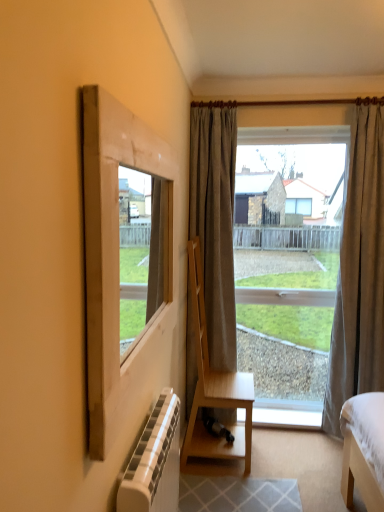
Where is `white painted wood at lower center`? white painted wood at lower center is located at coordinates (287, 414).

Locate an element on the screen. natural wood frame at left is located at coordinates (119, 265).

Locate an element on the screen. clear glass window at center is located at coordinates (344, 217).

This screenshot has width=384, height=512. In order to click on matte gray curtain at right, positioned as the 2th curtain in left-to-right order in this screenshot , I will do `click(359, 272)`.

Find the location of `white textured radiator at lower left`. white textured radiator at lower left is located at coordinates (154, 462).

Where is `white painted wood at lower center`? This screenshot has width=384, height=512. white painted wood at lower center is located at coordinates (287, 414).

Visually, is white painted wood at lower center positioned to the left or to the right of gray fabric curtain at center, the 1th curtain positioned from the left?

From the image, it's evident that white painted wood at lower center is to the right of gray fabric curtain at center, the 1th curtain positioned from the left.

Identify the location of the 1st curtain in front of the white painted wood at lower center. The height and width of the screenshot is (512, 384). (215, 224).

Is white painted wood at lower center facing towards gray fabric curtain at center, marked as the 2th curtain in a right-to-left arrangement?

No.

From the picture: Considering the relative sizes of white painted wood at lower center and gray fabric curtain at center, the 1th curtain positioned from the left, in the image provided, is white painted wood at lower center wider than gray fabric curtain at center, the 1th curtain positioned from the left,?

Yes.

Is matte gray curtain at right, the first curtain positioned from the right, not near light brown wooden chair at center?

No.

Does matte gray curtain at right, positioned as the 2th curtain in left-to-right order, lie behind light brown wooden chair at center?

Yes, matte gray curtain at right, positioned as the 2th curtain in left-to-right order, is behind light brown wooden chair at center.

Is matte gray curtain at right, positioned as the 2th curtain in left-to-right order, taller than light brown wooden chair at center?

Yes.

Considering the relative positions of matte gray curtain at right, the first curtain positioned from the right, and light brown wooden chair at center in the image provided, is matte gray curtain at right, the first curtain positioned from the right, to the left or to the right of light brown wooden chair at center?

matte gray curtain at right, the first curtain positioned from the right, is to the right of light brown wooden chair at center.

Can you confirm if white painted wood at lower center is bigger than natural wood frame at left?

Incorrect, white painted wood at lower center is not larger than natural wood frame at left.

Is white painted wood at lower center located outside natural wood frame at left?

Yes, white painted wood at lower center is outside of natural wood frame at left.

Is white painted wood at lower center closer to the viewer compared to natural wood frame at left?

No.

Considering their positions, is gray fabric curtain at center, the 1th curtain positioned from the left, located in front of or behind white textured radiator at lower left?

gray fabric curtain at center, the 1th curtain positioned from the left, is positioned farther from the viewer than white textured radiator at lower left.

Is gray fabric curtain at center, the 1th curtain positioned from the left, positioned far away from white textured radiator at lower left?

Yes, gray fabric curtain at center, the 1th curtain positioned from the left, is far from white textured radiator at lower left.

Locate an element on the screen. This screenshot has width=384, height=512. radiator in front of the gray fabric curtain at center, marked as the 2th curtain in a right-to-left arrangement is located at coordinates (154, 462).

Is white textured radiator at lower left oriented away from matte gray curtain at right, the first curtain positioned from the right?

No, matte gray curtain at right, the first curtain positioned from the right, is not at the back of white textured radiator at lower left.

Does white textured radiator at lower left have a greater width compared to matte gray curtain at right, the first curtain positioned from the right?

Incorrect, the width of white textured radiator at lower left does not surpass that of matte gray curtain at right, the first curtain positioned from the right.

Is white textured radiator at lower left not inside matte gray curtain at right, the first curtain positioned from the right?

Yes, white textured radiator at lower left is outside of matte gray curtain at right, the first curtain positioned from the right.

Based on the photo, is gray fabric curtain at center, marked as the 2th curtain in a right-to-left arrangement, touching clear glass window at center?

No, gray fabric curtain at center, marked as the 2th curtain in a right-to-left arrangement, is not in contact with clear glass window at center.

Looking at this image, could you measure the distance between gray fabric curtain at center, marked as the 2th curtain in a right-to-left arrangement, and clear glass window at center?

gray fabric curtain at center, marked as the 2th curtain in a right-to-left arrangement, and clear glass window at center are 18.42 inches apart.

Does gray fabric curtain at center, marked as the 2th curtain in a right-to-left arrangement, have a greater height compared to clear glass window at center?

No.

Is gray fabric curtain at center, marked as the 2th curtain in a right-to-left arrangement, to the right of clear glass window at center from the viewer's perspective?

In fact, gray fabric curtain at center, marked as the 2th curtain in a right-to-left arrangement, is to the left of clear glass window at center.

Is clear glass window at center far from white textured radiator at lower left?

Indeed, clear glass window at center is not near white textured radiator at lower left.

Measure the distance from clear glass window at center to white textured radiator at lower left.

clear glass window at center and white textured radiator at lower left are 5.45 feet apart from each other.

Is clear glass window at center oriented away from white textured radiator at lower left?

clear glass window at center is not turned away from white textured radiator at lower left.

From a real-world perspective, who is located higher, clear glass window at center or white textured radiator at lower left?

clear glass window at center, from a real-world perspective.

Where is `window sill located behind the gray fabric curtain at center, marked as the 2th curtain in a right-to-left arrangement`? Image resolution: width=384 pixels, height=512 pixels. window sill located behind the gray fabric curtain at center, marked as the 2th curtain in a right-to-left arrangement is located at coordinates (287, 414).

At what (x,y) coordinates should I click in order to perform the action: click on curtain on the right side of light brown wooden chair at center. Please return your answer as a coordinate pair (x, y). This screenshot has height=512, width=384. Looking at the image, I should click on (359, 272).

From the image, which object appears to be nearer to light brown wooden chair at center, clear glass window at center or white textured radiator at lower left?

Among the two, clear glass window at center is located nearer to light brown wooden chair at center.

Looking at the image, which one is located closer to white painted wood at lower center, natural wood frame at left or matte gray curtain at right, positioned as the 2th curtain in left-to-right order?

Based on the image, matte gray curtain at right, positioned as the 2th curtain in left-to-right order, appears to be nearer to white painted wood at lower center.

When comparing their distances from gray fabric curtain at center, marked as the 2th curtain in a right-to-left arrangement, does white painted wood at lower center or white textured radiator at lower left seem closer?

white painted wood at lower center.

From the image, which object appears to be farther from white textured radiator at lower left, matte gray curtain at right, positioned as the 2th curtain in left-to-right order, or gray fabric curtain at center, the 1th curtain positioned from the left?

Among the two, matte gray curtain at right, positioned as the 2th curtain in left-to-right order, is located further to white textured radiator at lower left.

Considering their positions, is white textured radiator at lower left positioned further to matte gray curtain at right, the first curtain positioned from the right, than clear glass window at center?

white textured radiator at lower left is further to matte gray curtain at right, the first curtain positioned from the right.

Considering their positions, is gray fabric curtain at center, marked as the 2th curtain in a right-to-left arrangement, positioned closer to light brown wooden chair at center than white painted wood at lower center?

Among the two, gray fabric curtain at center, marked as the 2th curtain in a right-to-left arrangement, is located nearer to light brown wooden chair at center.

Looking at the image, which one is located further to matte gray curtain at right, positioned as the 2th curtain in left-to-right order, white painted wood at lower center or white textured radiator at lower left?

Based on the image, white textured radiator at lower left appears to be further to matte gray curtain at right, positioned as the 2th curtain in left-to-right order.

Based on their spatial positions, is light brown wooden chair at center or gray fabric curtain at center, marked as the 2th curtain in a right-to-left arrangement, further from white painted wood at lower center?

gray fabric curtain at center, marked as the 2th curtain in a right-to-left arrangement, is further to white painted wood at lower center.

This screenshot has width=384, height=512. What are the coordinates of `curtain between gray fabric curtain at center, marked as the 2th curtain in a right-to-left arrangement, and white painted wood at lower center in the up-down direction` in the screenshot? It's located at (359, 272).

Image resolution: width=384 pixels, height=512 pixels. Identify the location of window between light brown wooden chair at center and matte gray curtain at right, positioned as the 2th curtain in left-to-right order, from left to right. (344, 217).

Where is `radiator positioned between natural wood frame at left and light brown wooden chair at center from near to far`? This screenshot has width=384, height=512. radiator positioned between natural wood frame at left and light brown wooden chair at center from near to far is located at coordinates (154, 462).

This screenshot has height=512, width=384. Find the location of `radiator between natural wood frame at left and matte gray curtain at right, positioned as the 2th curtain in left-to-right order, in the front-back direction`. radiator between natural wood frame at left and matte gray curtain at right, positioned as the 2th curtain in left-to-right order, in the front-back direction is located at coordinates (154, 462).